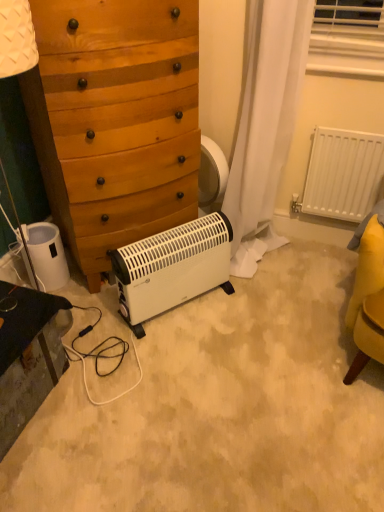
Question: Is white plastic radiator at right surrounded by white plastic heater at lower left?

Choices:
 (A) no
 (B) yes

Answer: (A)

Question: Is white plastic heater at lower left located outside white plastic radiator at right?

Choices:
 (A) yes
 (B) no

Answer: (A)

Question: From a real-world perspective, is white plastic heater at lower left beneath white plastic radiator at right?

Choices:
 (A) no
 (B) yes

Answer: (B)

Question: Considering the relative sizes of white plastic heater at lower left and white plastic radiator at right in the image provided, is white plastic heater at lower left shorter than white plastic radiator at right?

Choices:
 (A) no
 (B) yes

Answer: (B)

Question: Is there a large distance between white plastic heater at lower left and white plastic radiator at right?

Choices:
 (A) yes
 (B) no

Answer: (A)

Question: Is white plastic heater at lower left wider than white plastic radiator at right?

Choices:
 (A) no
 (B) yes

Answer: (B)

Question: Can you confirm if white plastic heater at lower left is shorter than black glossy vanity at lower left?

Choices:
 (A) yes
 (B) no

Answer: (A)

Question: From a real-world perspective, is white plastic heater at lower left beneath black glossy vanity at lower left?

Choices:
 (A) yes
 (B) no

Answer: (B)

Question: Is white plastic heater at lower left to the right of black glossy vanity at lower left from the viewer's perspective?

Choices:
 (A) no
 (B) yes

Answer: (A)

Question: Is white plastic heater at lower left positioned in front of black glossy vanity at lower left?

Choices:
 (A) no
 (B) yes

Answer: (A)

Question: Are white plastic heater at lower left and black glossy vanity at lower left beside each other?

Choices:
 (A) yes
 (B) no

Answer: (B)

Question: Would you consider white plastic heater at lower left to be distant from black glossy vanity at lower left?

Choices:
 (A) no
 (B) yes

Answer: (A)

Question: From the image's perspective, is white plastic radiator at right beneath white plastic heater at lower left?

Choices:
 (A) no
 (B) yes

Answer: (A)